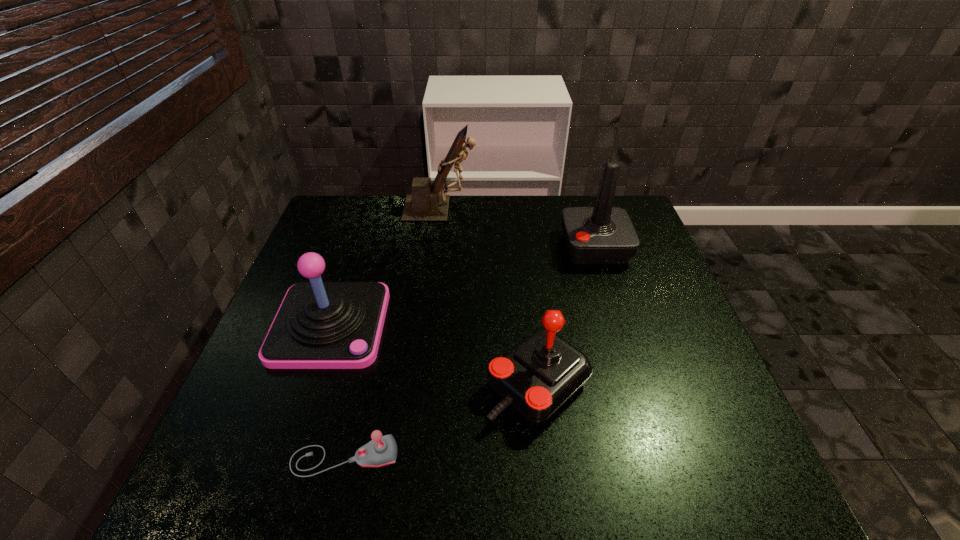
What are the coordinates of `figurine that is positioned at the far edge` in the screenshot? It's located at (425, 204).

At what (x,y) coordinates should I click in order to perform the action: click on joystick located at the far edge. Please return your answer as a coordinate pair (x, y). The height and width of the screenshot is (540, 960). Looking at the image, I should click on (603, 234).

You are a GUI agent. You are given a task and a screenshot of the screen. Output one action in this format:
    pyautogui.click(x=<x>, y=<y>)
    Task: Click on the object located at the near edge
    The image size is (960, 540).
    Given the screenshot: What is the action you would take?
    pyautogui.click(x=382, y=450)

At what (x,y) coordinates should I click in order to perform the action: click on object that is at the right edge. Please return your answer as a coordinate pair (x, y). Looking at the image, I should click on (603, 234).

Image resolution: width=960 pixels, height=540 pixels. What are the coordinates of `object that is at the near left corner` in the screenshot? It's located at (382, 450).

Where is `object at the far right corner`? object at the far right corner is located at coordinates (603, 234).

In order to click on vacant area at the far edge of the desktop in this screenshot , I will do `click(406, 230)`.

In order to click on vacant region at the near edge of the desktop in this screenshot , I will do `click(616, 478)`.

The image size is (960, 540). In the image, there is a desktop. Identify the location of free space at the left edge. (339, 268).

Find the location of a particular element. Image resolution: width=960 pixels, height=540 pixels. vacant space at the right edge of the desktop is located at coordinates coord(658,254).